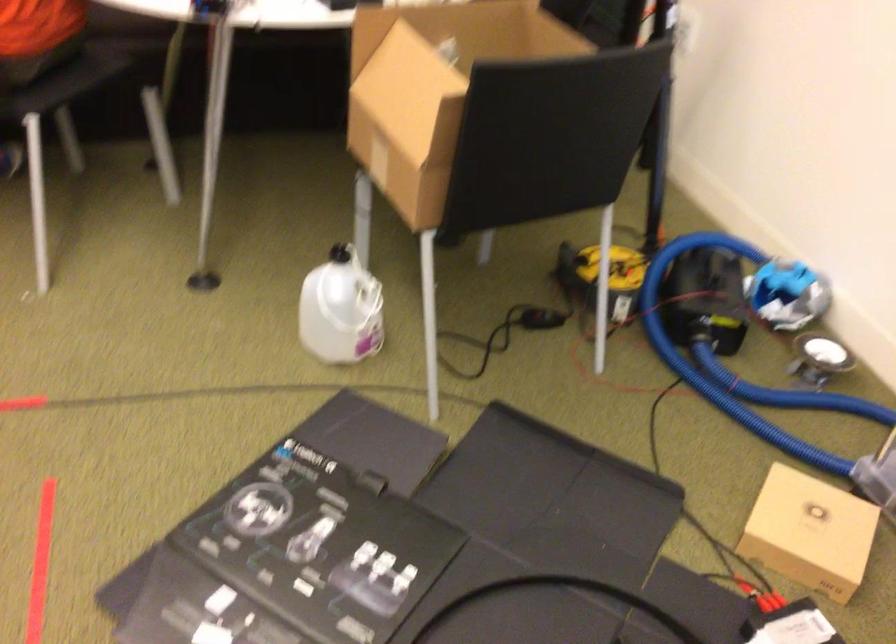
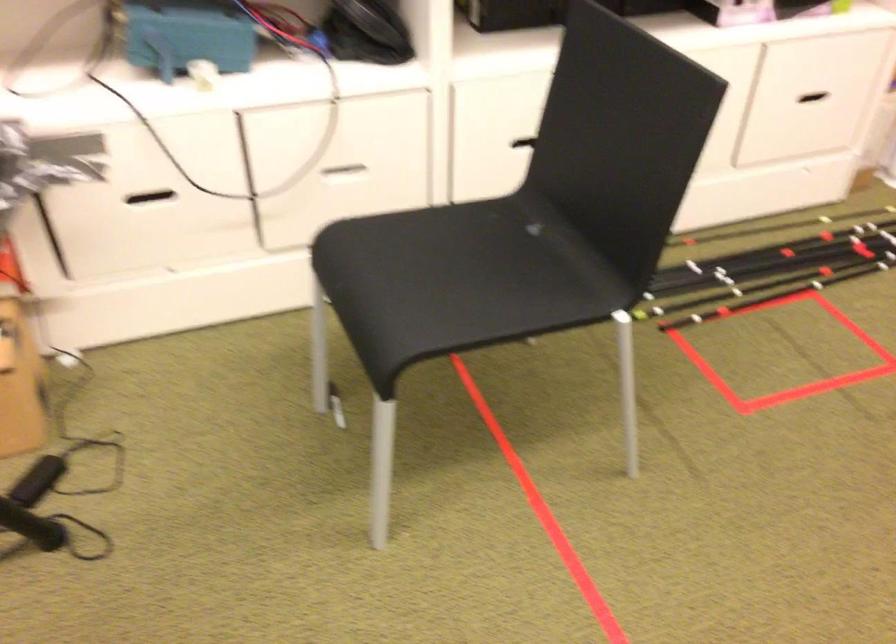
The first image is from the beginning of the video and the second image is from the end. How did the camera likely rotate when shooting the video?

The camera's rotation is toward left-down.